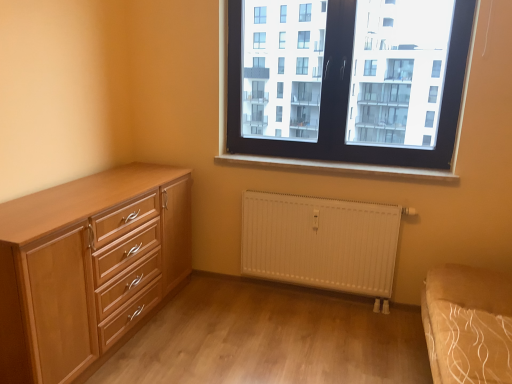
Image resolution: width=512 pixels, height=384 pixels. Find the location of `vacant region under white matte radiator at lower center (from a real-world perspective)`. vacant region under white matte radiator at lower center (from a real-world perspective) is located at coordinates (313, 297).